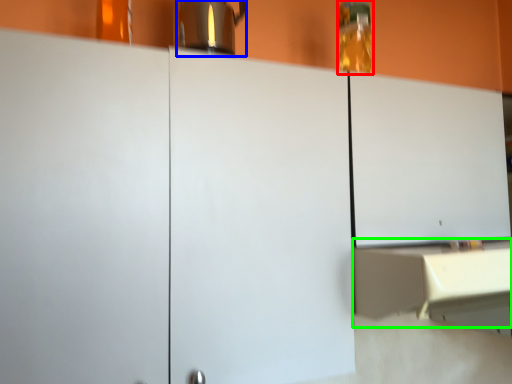
Question: Which object is positioned farthest from bottle (highlighted by a red box)? Select from coffeepot (highlighted by a blue box) and counter (highlighted by a green box).

Choices:
 (A) coffeepot
 (B) counter

Answer: (B)